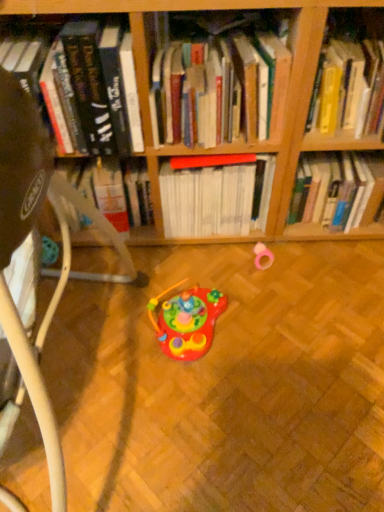
Image resolution: width=384 pixels, height=512 pixels. I want to click on free region under shiny plastic toy at center, which is the first toy in left-to-right order (from a real-world perspective), so click(211, 339).